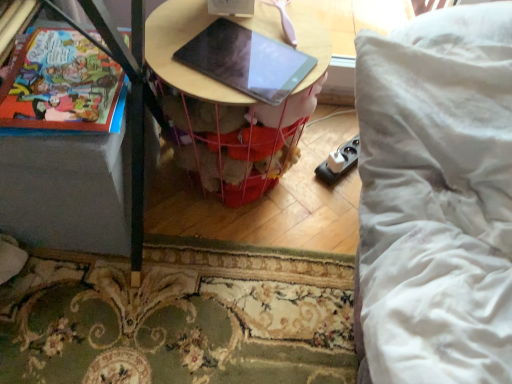
Locate an element on the screen. The image size is (512, 384). blank space situated above wooden table at center (from a real-world perspective) is located at coordinates (256, 45).